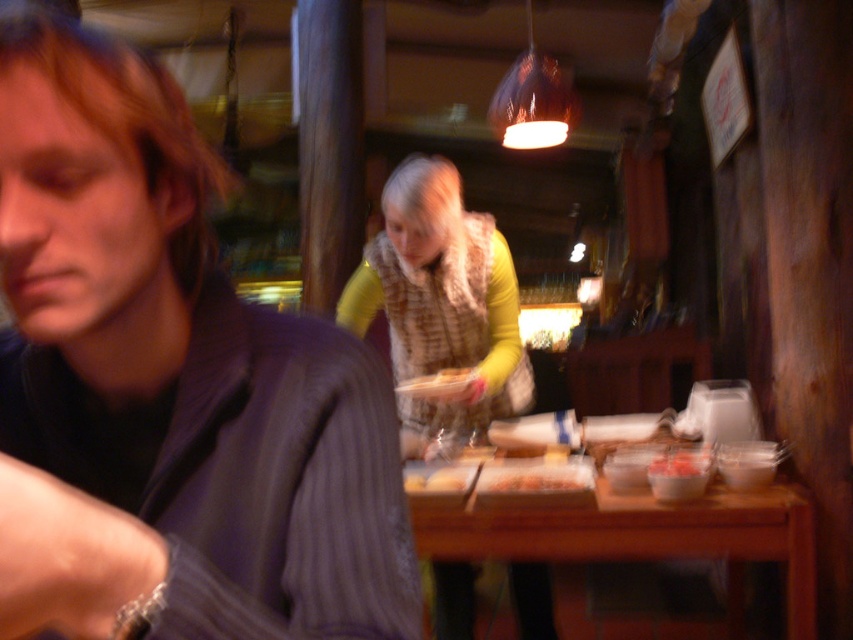
You are a photographer trying to capture a closeup of the smooth white bread at center without including the dark gray striped shirt at left in the frame. Given their sizes, is this possible?

The dark gray striped shirt at left is wider than the smooth white bread at center, so it might be challenging to frame the bread without including the shirt if they are positioned closely together. Adjusting the camera angle or moving closer to the bread could help isolate it.

You are a photographer trying to adjust your camera to focus on the dark gray striped shirt at left. According to the coordinates provided, where exactly should you position your camera focus point?

The dark gray striped shirt at left is located at coordinates point (169, 387), so you should position your camera focus point there to focus on it.